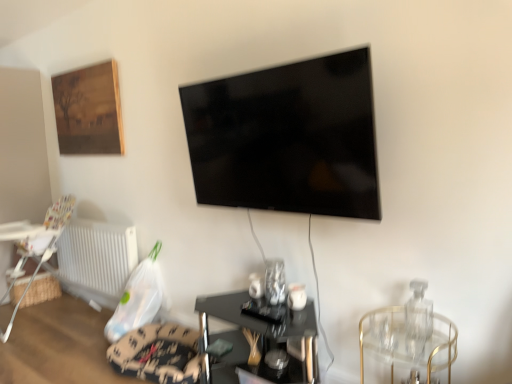
What do you see at coordinates (97, 254) in the screenshot? The height and width of the screenshot is (384, 512). I see `white plastic radiator at lower left` at bounding box center [97, 254].

The height and width of the screenshot is (384, 512). Describe the element at coordinates (158, 354) in the screenshot. I see `velvet-like beige swivel chair at lower center` at that location.

Where is `velvet-like beige swivel chair at lower center`? velvet-like beige swivel chair at lower center is located at coordinates (158, 354).

Describe the element at coordinates (19, 230) in the screenshot. Image resolution: width=512 pixels, height=384 pixels. I see `woven wood table at left, acting as the 1th table starting from the left` at that location.

This screenshot has width=512, height=384. In order to click on wooden framed painting at upper left in this screenshot , I will do coord(89,110).

Find the location of a particular element. This screenshot has height=384, width=512. clear glass table at right is located at coordinates (406, 347).

Is black glass table at center, the second table in the left-to-right sequence, positioned beyond the bounds of clear glass table at right?

Indeed, black glass table at center, the second table in the left-to-right sequence, is completely outside clear glass table at right.

Considering the sizes of black glass table at center, the second table in the left-to-right sequence, and clear glass table at right in the image, is black glass table at center, the second table in the left-to-right sequence, wider or thinner than clear glass table at right?

In the image, black glass table at center, the second table in the left-to-right sequence, appears to be wider than clear glass table at right.

Which point is more distant from viewer, (282,311) or (417,316)?

Positioned behind is point (282,311).

Considering the positions of objects white plastic highchair at lower left and black glass table at center, the 1th table viewed from the front, in the image provided, who is more to the left, white plastic highchair at lower left or black glass table at center, the 1th table viewed from the front,?

Positioned to the left is white plastic highchair at lower left.

From a real-world perspective, between white plastic highchair at lower left and black glass table at center, the second table in the left-to-right sequence, who is vertically lower?

black glass table at center, the second table in the left-to-right sequence, from a real-world perspective.

Consider the image. Could black glass table at center, which is the 2th table from back to front, be considered to be inside white plastic highchair at lower left?

That's incorrect, black glass table at center, which is the 2th table from back to front, is not inside white plastic highchair at lower left.

Find the location of a particular element. The height and width of the screenshot is (384, 512). chair located above the black glass table at center, the second table in the left-to-right sequence (from a real-world perspective) is located at coordinates (35, 244).

Consider the image. Measure the distance from velvet-like beige swivel chair at lower center to white plastic highchair at lower left.

velvet-like beige swivel chair at lower center and white plastic highchair at lower left are 4.26 feet apart.

Considering the relative positions of velvet-like beige swivel chair at lower center and white plastic highchair at lower left in the image provided, is velvet-like beige swivel chair at lower center to the left of white plastic highchair at lower left from the viewer's perspective?

Incorrect, velvet-like beige swivel chair at lower center is not on the left side of white plastic highchair at lower left.

Is velvet-like beige swivel chair at lower center not close to white plastic highchair at lower left?

Yes.

Can you tell me how much velvet-like beige swivel chair at lower center and white plastic highchair at lower left differ in facing direction?

0.559 degrees separate the facing orientations of velvet-like beige swivel chair at lower center and white plastic highchair at lower left.

Does velvet-like beige swivel chair at lower center appear on the right side of black glossy tv at upper center?

In fact, velvet-like beige swivel chair at lower center is to the left of black glossy tv at upper center.

From a real-world perspective, who is located lower, velvet-like beige swivel chair at lower center or black glossy tv at upper center?

velvet-like beige swivel chair at lower center, from a real-world perspective.

From the image's perspective, which object appears higher, velvet-like beige swivel chair at lower center or black glossy tv at upper center?

From the image's view, black glossy tv at upper center is above.

Is velvet-like beige swivel chair at lower center positioned with its back to black glossy tv at upper center?

velvet-like beige swivel chair at lower center does not have its back to black glossy tv at upper center.

Does velvet-like beige swivel chair at lower center have a smaller size compared to black glass table at center, the 1th table viewed from the front?

Yes, velvet-like beige swivel chair at lower center is smaller than black glass table at center, the 1th table viewed from the front.

Considering their positions, is velvet-like beige swivel chair at lower center located in front of or behind black glass table at center, the 1th table viewed from the front?

velvet-like beige swivel chair at lower center is behind black glass table at center, the 1th table viewed from the front.

From a real-world perspective, does velvet-like beige swivel chair at lower center stand above black glass table at center, the 1th table viewed from the front?

No, from a real-world perspective, velvet-like beige swivel chair at lower center is not above black glass table at center, the 1th table viewed from the front.

Looking at this image, from the image's perspective, would you say black glossy tv at upper center is positioned over black glass table at center, the 1th table viewed from the front?

Yes, from the image's perspective, black glossy tv at upper center is above black glass table at center, the 1th table viewed from the front.

Is black glossy tv at upper center oriented towards black glass table at center, the 1th table viewed from the front?

No, black glossy tv at upper center is not turned towards black glass table at center, the 1th table viewed from the front.

Is black glossy tv at upper center directly adjacent to black glass table at center, which is the 2th table from back to front?

There is a gap between black glossy tv at upper center and black glass table at center, which is the 2th table from back to front.

Which object is thinner, black glossy tv at upper center or black glass table at center, which is the 2th table from back to front?

black glossy tv at upper center is thinner.

Considering the relative positions of black glossy tv at upper center and white plastic highchair at lower left in the image provided, is black glossy tv at upper center to the left or to the right of white plastic highchair at lower left?

Clearly, black glossy tv at upper center is on the right of white plastic highchair at lower left in the image.

From the picture: Considering the relative sizes of black glossy tv at upper center and white plastic highchair at lower left in the image provided, is black glossy tv at upper center smaller than white plastic highchair at lower left?

Indeed, black glossy tv at upper center has a smaller size compared to white plastic highchair at lower left.

Considering the sizes of objects black glossy tv at upper center and white plastic highchair at lower left in the image provided, who is thinner, black glossy tv at upper center or white plastic highchair at lower left?

black glossy tv at upper center is thinner.

From the image's perspective, is black glossy tv at upper center above or below white plastic highchair at lower left?

black glossy tv at upper center is above white plastic highchair at lower left.

Find the location of a particular element. The height and width of the screenshot is (384, 512). glass table on the right of black glass table at center, arranged as the 1th table when viewed from the right is located at coordinates (406, 347).

Where is `chair behind the black glass table at center, arranged as the 1th table when viewed from the right`? This screenshot has width=512, height=384. chair behind the black glass table at center, arranged as the 1th table when viewed from the right is located at coordinates (35, 244).

From the image, which object appears to be nearer to white plastic highchair at lower left, black glossy tv at upper center or white plastic radiator at lower left?

white plastic radiator at lower left.

Which object lies nearer to the anchor point white plastic radiator at lower left, black glass table at center, the second table in the left-to-right sequence, or woven wood table at left, acting as the 1th table starting from the left?

The object closer to white plastic radiator at lower left is woven wood table at left, acting as the 1th table starting from the left.

Estimate the real-world distances between objects in this image. Which object is further from white plastic highchair at lower left, clear glass table at right or black glossy tv at upper center?

The object further to white plastic highchair at lower left is clear glass table at right.

Based on their spatial positions, is white plastic highchair at lower left or velvet-like beige swivel chair at lower center closer to woven wood table at left, marked as the 2th table in a front-to-back arrangement?

white plastic highchair at lower left.

Based on their spatial positions, is clear glass table at right or white plastic radiator at lower left closer to wooden framed painting at upper left?

The object closer to wooden framed painting at upper left is white plastic radiator at lower left.

Based on their spatial positions, is black glass table at center, arranged as the 1th table when viewed from the right, or black glossy tv at upper center closer to white plastic highchair at lower left?

The object closer to white plastic highchair at lower left is black glass table at center, arranged as the 1th table when viewed from the right.

Estimate the real-world distances between objects in this image. Which object is closer to velvet-like beige swivel chair at lower center, clear glass table at right or white plastic radiator at lower left?

white plastic radiator at lower left is closer to velvet-like beige swivel chair at lower center.

Looking at the image, which one is located closer to wooden framed painting at upper left, black glossy tv at upper center or white plastic highchair at lower left?

white plastic highchair at lower left.

Where is `radiator situated between wooden framed painting at upper left and black glass table at center, the 1th table viewed from the front, from left to right`? radiator situated between wooden framed painting at upper left and black glass table at center, the 1th table viewed from the front, from left to right is located at coordinates (97, 254).

At what (x,y) coordinates should I click in order to perform the action: click on chair situated between woven wood table at left, marked as the 2th table in a front-to-back arrangement, and clear glass table at right from left to right. Please return your answer as a coordinate pair (x, y). Image resolution: width=512 pixels, height=384 pixels. Looking at the image, I should click on (35, 244).

Locate an element on the screen. picture frame located between woven wood table at left, the 1th table in the back-to-front sequence, and black glass table at center, the second table in the left-to-right sequence, in the left-right direction is located at coordinates (89, 110).

At what (x,y) coordinates should I click in order to perform the action: click on chair located between woven wood table at left, acting as the 1th table starting from the left, and white plastic radiator at lower left in the left-right direction. Please return your answer as a coordinate pair (x, y). This screenshot has width=512, height=384. Looking at the image, I should click on (35, 244).